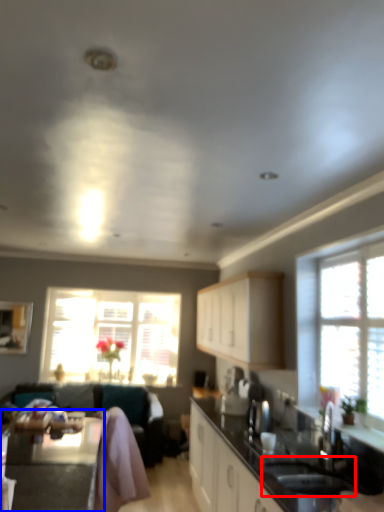
Question: Among these objects, which one is farthest to the camera, sink (highlighted by a red box) or table (highlighted by a blue box)?

Choices:
 (A) sink
 (B) table

Answer: (A)